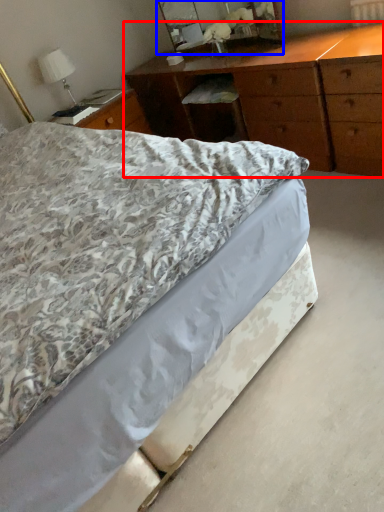
Question: Among these objects, which one is nearest to the camera, chest of drawers (highlighted by a red box) or mirror (highlighted by a blue box)?

Choices:
 (A) chest of drawers
 (B) mirror

Answer: (A)